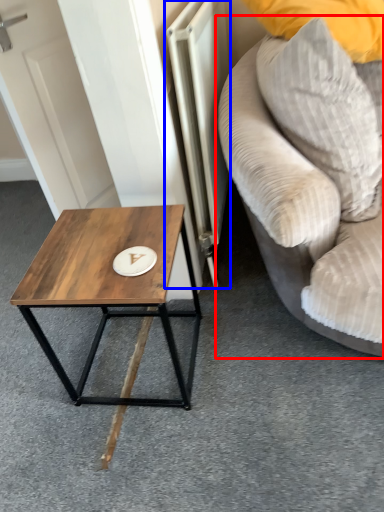
Question: Among these objects, which one is farthest to the camera, studio couch (highlighted by a red box) or radiator (highlighted by a blue box)?

Choices:
 (A) studio couch
 (B) radiator

Answer: (B)